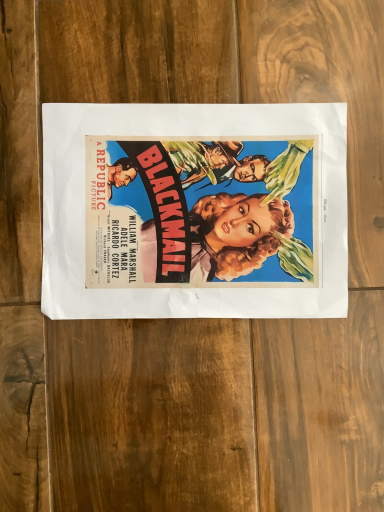
Question: Should I look upward or downward to see matte paper poster at center?

Choices:
 (A) up
 (B) down

Answer: (A)